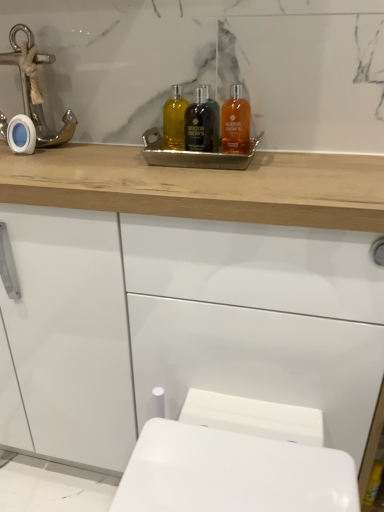
I want to click on free spot in front of metallic anchor at left, so click(33, 151).